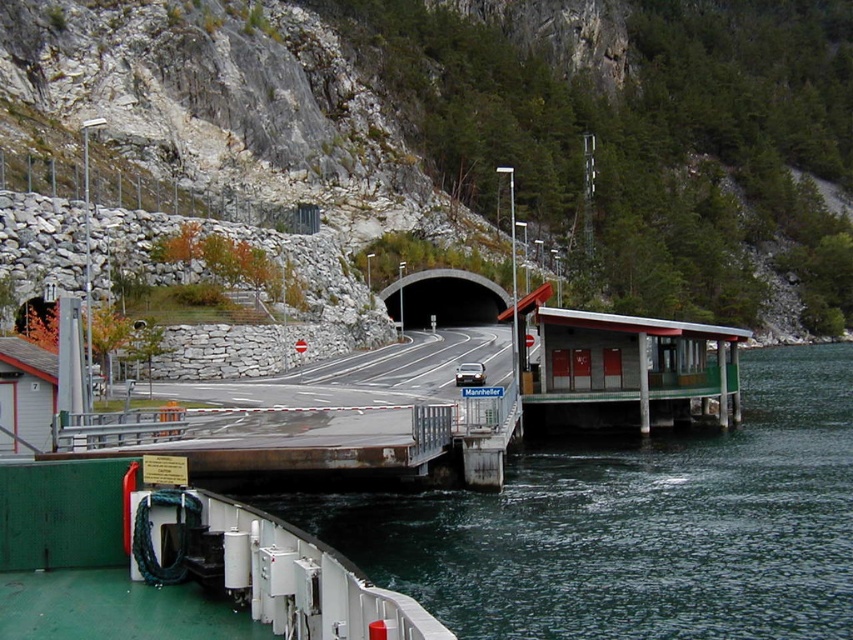
Question: Which object is farther from the camera taking this photo?

Choices:
 (A) black concrete tunnel at center
 (B) dark blue water at lower center

Answer: (A)

Question: Which of the following is the closest to the observer?

Choices:
 (A) dark blue water at lower center
 (B) black concrete tunnel at center

Answer: (A)

Question: Can you confirm if dark blue water at lower center is smaller than black concrete tunnel at center?

Choices:
 (A) no
 (B) yes

Answer: (A)

Question: Does dark blue water at lower center have a greater width compared to black concrete tunnel at center?

Choices:
 (A) no
 (B) yes

Answer: (B)

Question: Does dark blue water at lower center appear over black concrete tunnel at center?

Choices:
 (A) no
 (B) yes

Answer: (A)

Question: Among these points, which one is nearest to the camera?

Choices:
 (A) (834, 454)
 (B) (468, 288)

Answer: (A)